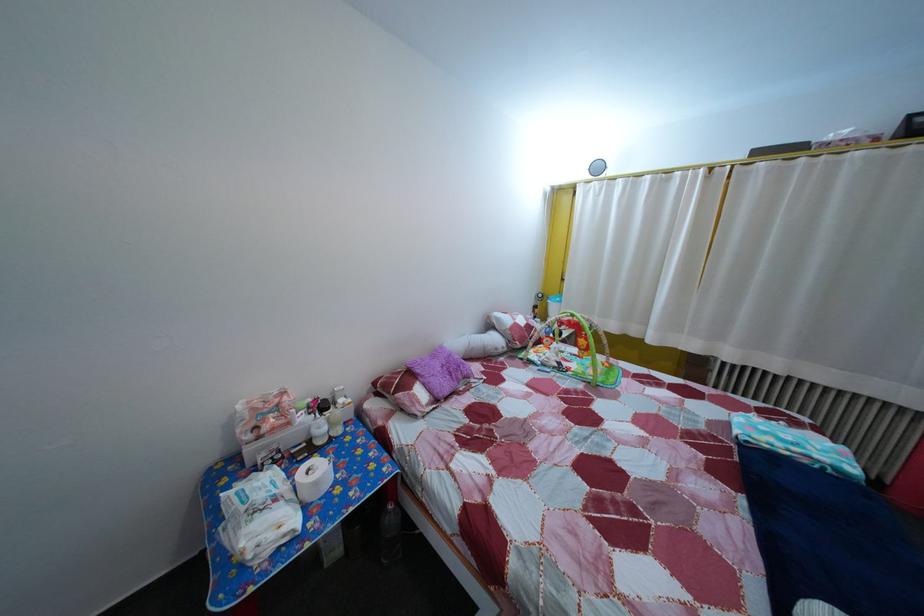
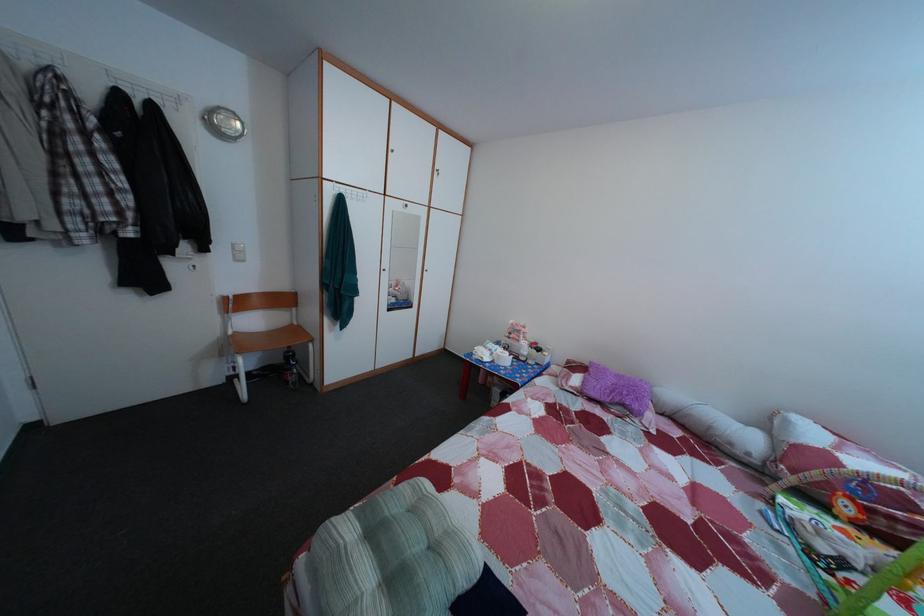
The point at [470,390] is marked in the first image. Where is the corresponding point in the second image?

(628, 416)